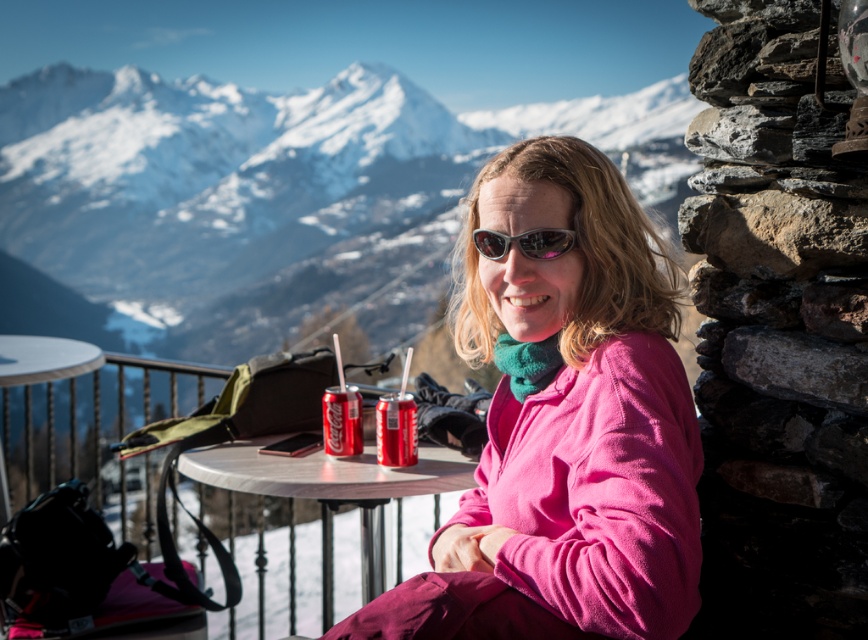
Question: Which of these objects is positioned closest to the sunglasses at center?

Choices:
 (A) red matte coca-cola can at center
 (B) pink fleece jacket at center
 (C) red matte can at center
 (D) metallic silver table at center

Answer: (B)

Question: Which object is positioned farthest from the sunglasses at center?

Choices:
 (A) metallic silver table at center
 (B) red matte coca-cola can at center
 (C) pink fleece jacket at center

Answer: (A)

Question: Does red matte can at center appear under sunglasses at center?

Choices:
 (A) no
 (B) yes

Answer: (B)

Question: Among these objects, which one is nearest to the camera?

Choices:
 (A) red matte can at center
 (B) sunglasses at center
 (C) red matte coca-cola can at center

Answer: (B)

Question: Is metallic silver table at center above red matte coca-cola can at center?

Choices:
 (A) yes
 (B) no

Answer: (B)

Question: Can you confirm if pink fleece jacket at center is positioned above red matte can at center?

Choices:
 (A) no
 (B) yes

Answer: (B)